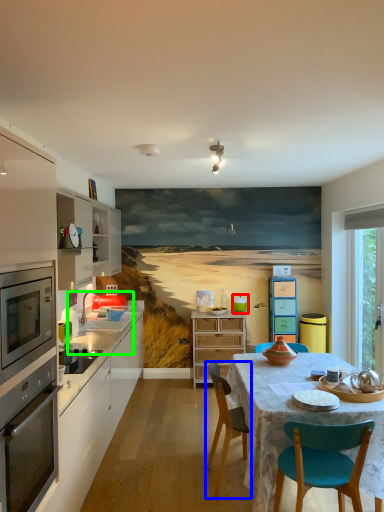
Question: Considering the real-world distances, which object is closest to teal (highlighted by a red box)? chair (highlighted by a blue box) or sink (highlighted by a green box).

Choices:
 (A) chair
 (B) sink

Answer: (B)